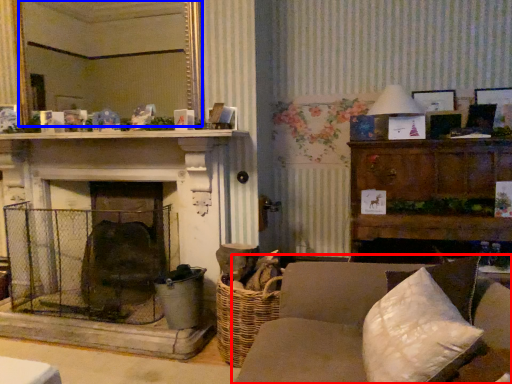
Question: Which point is closer to the camera, studio couch (highlighted by a red box) or mirror (highlighted by a blue box)?

Choices:
 (A) studio couch
 (B) mirror

Answer: (A)